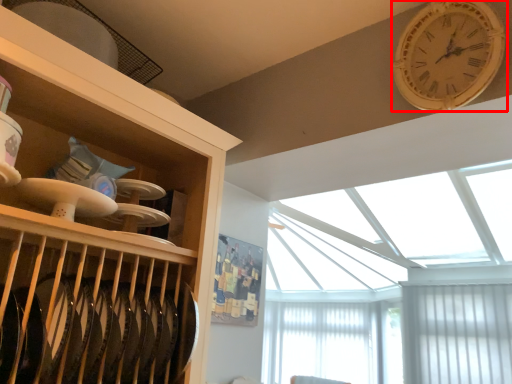
Question: Considering the relative positions of wall clock (annotated by the red box) and window screen in the image provided, where is wall clock (annotated by the red box) located with respect to the staircase?

Choices:
 (A) right
 (B) left

Answer: (B)